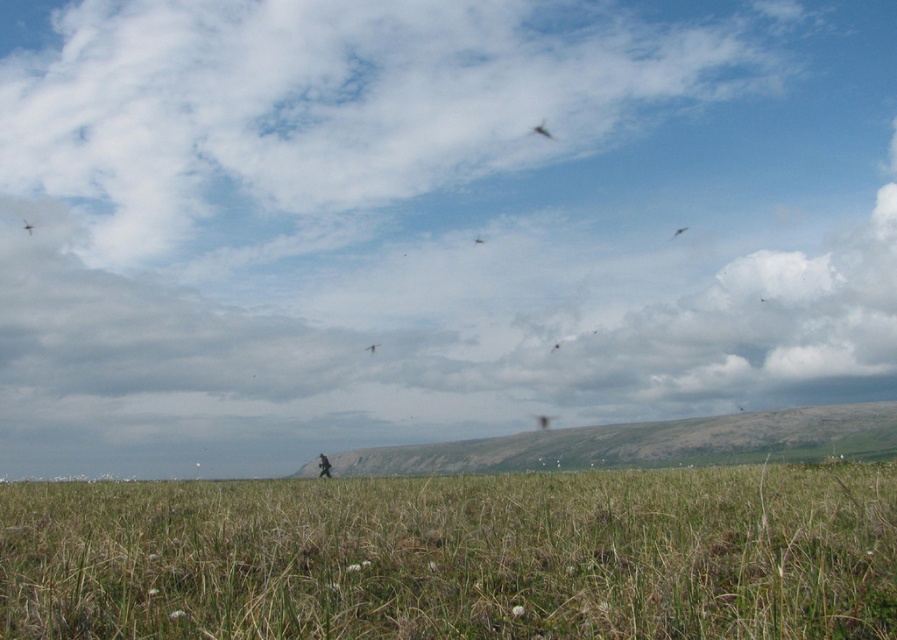
Image resolution: width=897 pixels, height=640 pixels. Describe the element at coordinates (541, 131) in the screenshot. I see `dark brown feathered bird at upper center` at that location.

Between point (544, 134) and point (23, 220), which one is positioned behind?

The point (23, 220) is behind.

Is point (530, 129) farther from camera compared to point (27, 230)?

No, (530, 129) is closer to viewer.

Where is `dark brown feathered bird at upper center`? This screenshot has width=897, height=640. dark brown feathered bird at upper center is located at coordinates (541, 131).

Looking at this image, does gray rocky hill at center have a greater height compared to brown feathered bird at center?

Yes.

Is gray rocky hill at center to the right of brown feathered bird at center from the viewer's perspective?

Indeed, gray rocky hill at center is positioned on the right side of brown feathered bird at center.

The height and width of the screenshot is (640, 897). What do you see at coordinates (649, 444) in the screenshot? I see `gray rocky hill at center` at bounding box center [649, 444].

Where is `gray rocky hill at center`? Image resolution: width=897 pixels, height=640 pixels. gray rocky hill at center is located at coordinates (649, 444).

Does smooth feathered bird at upper right appear over brown feathered bird at center?

Yes, smooth feathered bird at upper right is above brown feathered bird at center.

Measure the distance from smooth feathered bird at upper right to brown feathered bird at center.

smooth feathered bird at upper right is 13.73 meters from brown feathered bird at center.

This screenshot has width=897, height=640. In order to click on smooth feathered bird at upper right in this screenshot , I will do `click(678, 230)`.